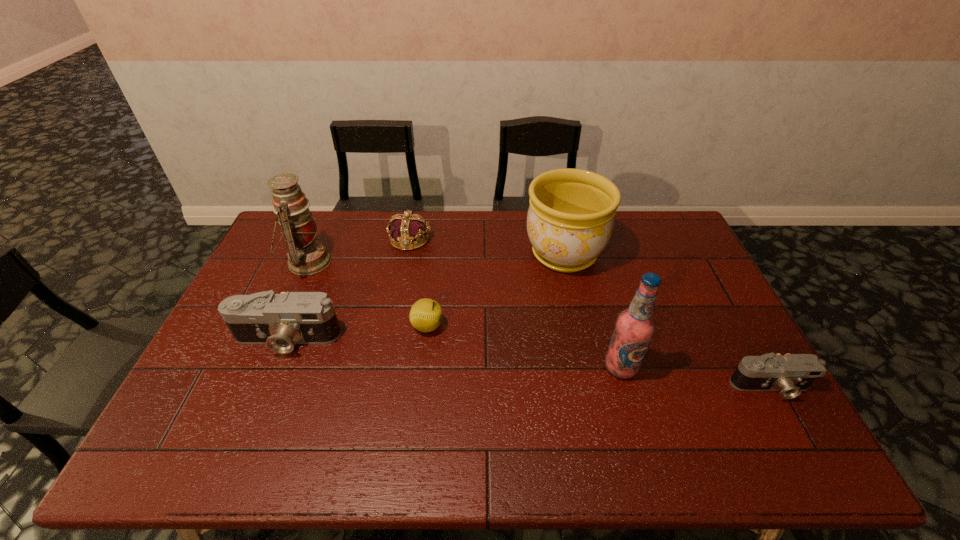
Where is `unoccupied area between the softball and the fifth tallest object`? Image resolution: width=960 pixels, height=540 pixels. unoccupied area between the softball and the fifth tallest object is located at coordinates (419, 282).

Where is `unoccupied position between the alcohol and the softball`? The height and width of the screenshot is (540, 960). unoccupied position between the alcohol and the softball is located at coordinates (524, 347).

Identify the location of vacant space in between the alcohol and the oil lamp. (465, 314).

Locate an element on the screen. This screenshot has height=540, width=960. vacant space that's between the farther camera and the softball is located at coordinates (x=357, y=333).

Locate an element on the screen. unoccupied area between the flowerpot and the taller camera is located at coordinates (425, 296).

Image resolution: width=960 pixels, height=540 pixels. What are the coordinates of `unoccupied area between the third tallest object and the nearer camera` in the screenshot? It's located at (667, 320).

Image resolution: width=960 pixels, height=540 pixels. I want to click on free spot between the flowerpot and the alcohol, so click(x=592, y=310).

Point out which object is positioned as the second nearest to the oil lamp. Please provide its 2D coordinates. Your answer should be formatted as a tuple, i.e. [(x, y)], where the tuple contains the x and y coordinates of a point satisfying the conditions above.

[(407, 227)]

Identify which object is the third closest to the taller camera. Please provide its 2D coordinates. Your answer should be formatted as a tuple, i.e. [(x, y)], where the tuple contains the x and y coordinates of a point satisfying the conditions above.

[(407, 227)]

Identify the location of vacant region that satisfies the following two spatial constraints: 1. on the logo side of the softball; 2. on the lens of the fourth tallest object. This screenshot has width=960, height=540. (426, 339).